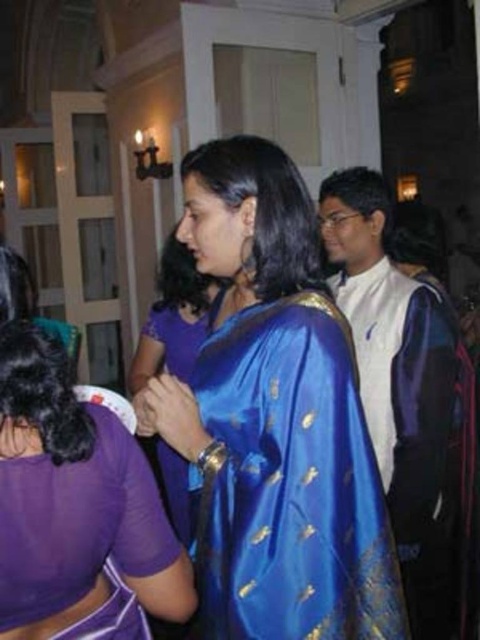
Question: Among these objects, which one is farthest from the camera?

Choices:
 (A) blue silk sari at center
 (B) purple satin blouse at lower left
 (C) satin blue saree at center
 (D) blue silk saree at center

Answer: (C)

Question: Can you confirm if blue silk saree at center is thinner than purple satin blouse at lower left?

Choices:
 (A) no
 (B) yes

Answer: (A)

Question: Which object appears closest to the camera in this image?

Choices:
 (A) blue silk saree at center
 (B) satin blue saree at center
 (C) blue silk sari at center
 (D) purple satin blouse at lower left

Answer: (D)

Question: Does blue silk saree at center have a lesser width compared to blue silk sari at center?

Choices:
 (A) yes
 (B) no

Answer: (B)

Question: From the image, what is the correct spatial relationship of blue silk sari at center in relation to satin blue saree at center?

Choices:
 (A) right
 (B) left

Answer: (A)

Question: Which object is farther from the camera taking this photo?

Choices:
 (A) blue silk saree at center
 (B) satin blue saree at center

Answer: (B)